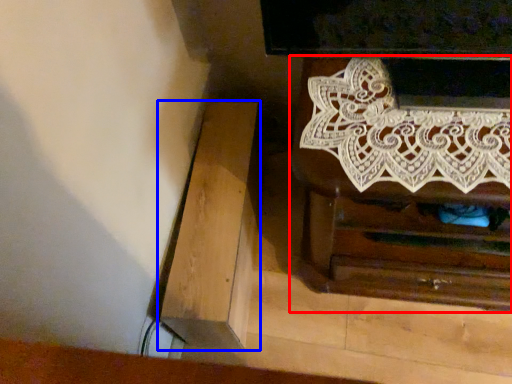
Question: Which point is closer to the camera, chest of drawers (highlighted by a red box) or furniture (highlighted by a blue box)?

Choices:
 (A) chest of drawers
 (B) furniture

Answer: (A)